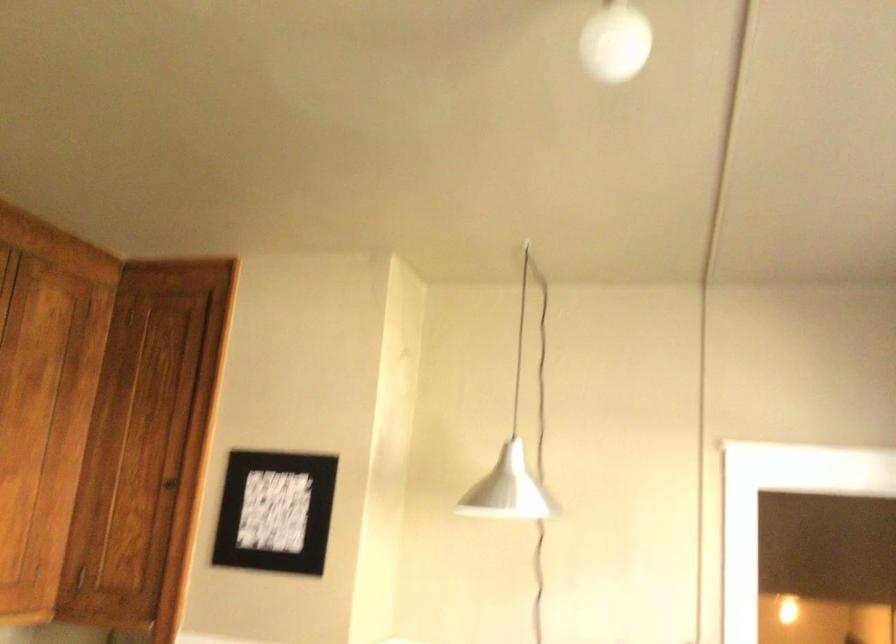
The image size is (896, 644). What do you see at coordinates (507, 489) in the screenshot?
I see `the silver lamp shade` at bounding box center [507, 489].